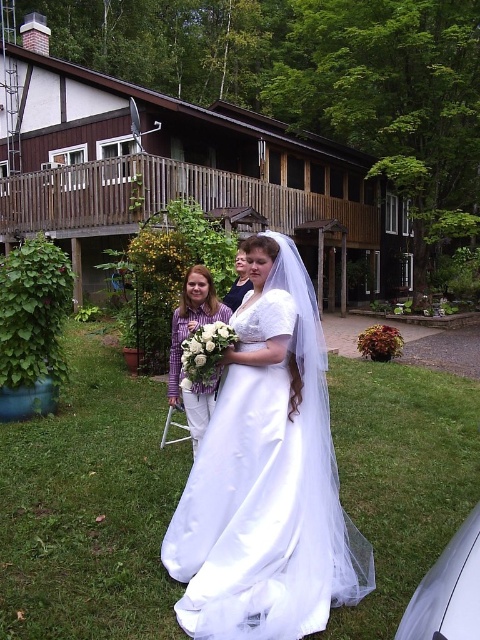
Looking at this image, you are a photographer planning to capture a group photo of the wedding party. The white satin dress at center and the purple striped shirt at center are in the frame. Considering the width of their outfits, which one would require more space to the left and right to avoid being cropped?

The white satin dress at center requires more space to the left and right because its width is larger than the purple striped shirt at center.

Looking at this image, you are a photographer setting up for a wedding photo shoot. You have two subjects in the frame, the white satin dress at center and the purple striped shirt at center. Which one should you focus on to ensure the subject is in focus given that the camera can only focus on one subject at a time?

The white satin dress at center is bigger than the purple striped shirt at center, so you should focus on the white satin dress at center to ensure the subject is in focus since larger objects are easier to focus on.

You are a photographer setting up for a wedding photo shoot. You need to position two key elements in the frame. The white satin dress at center and the purple striped shirt at center. According to the scene description, which one is more to the right?

The white satin dress at center is positioned on the right side of purple striped shirt at center, so it is more to the right.